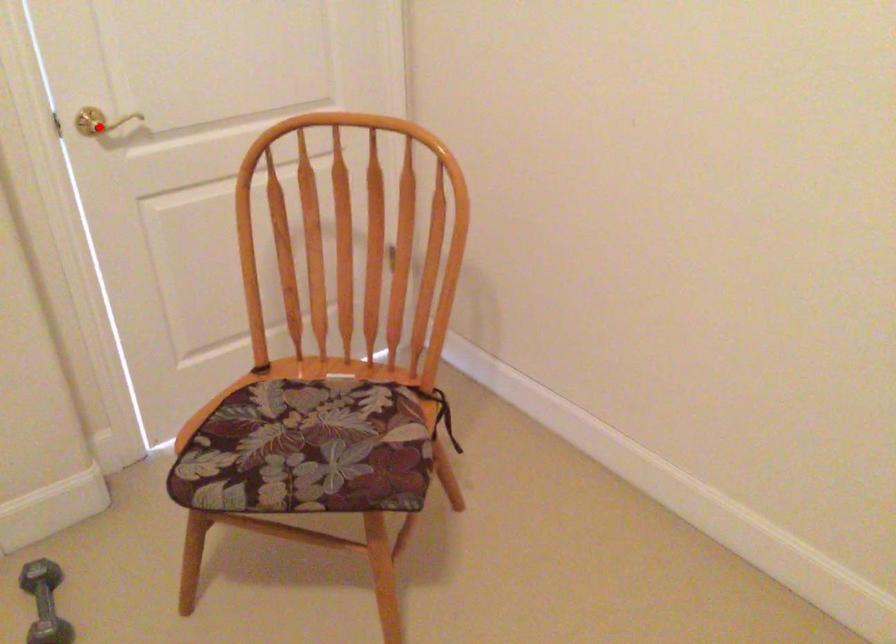
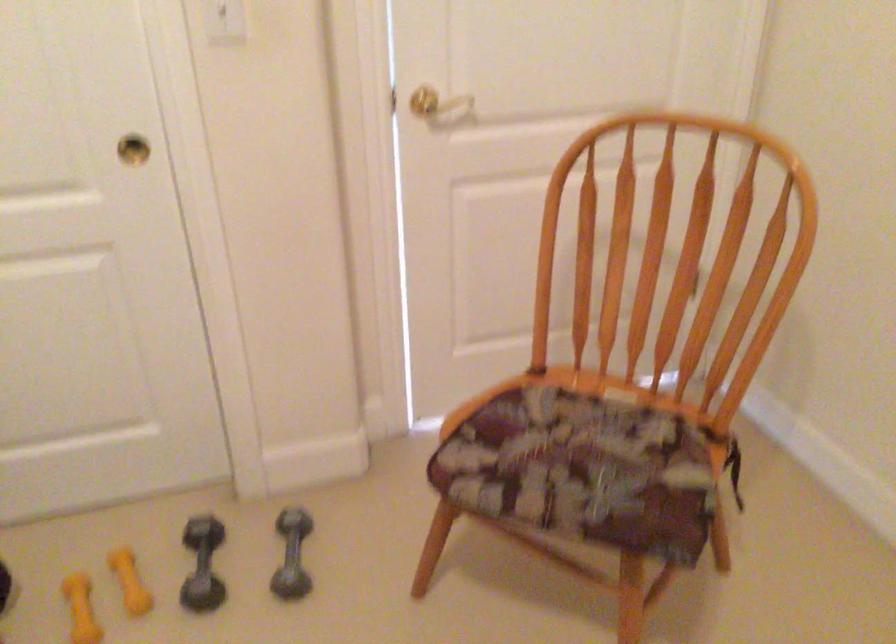
Find the pixel in the second image that matches the highlighted location in the first image.

(424, 102)